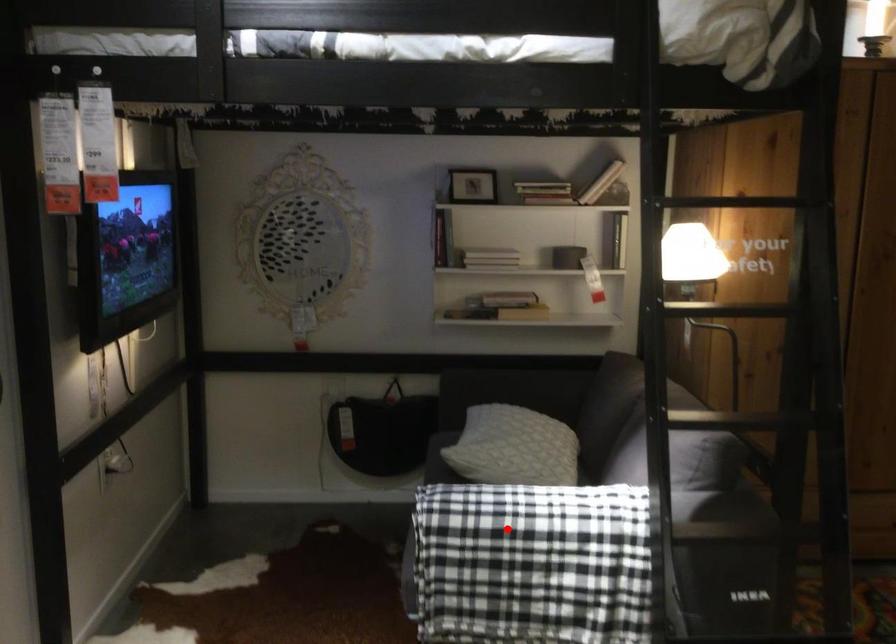
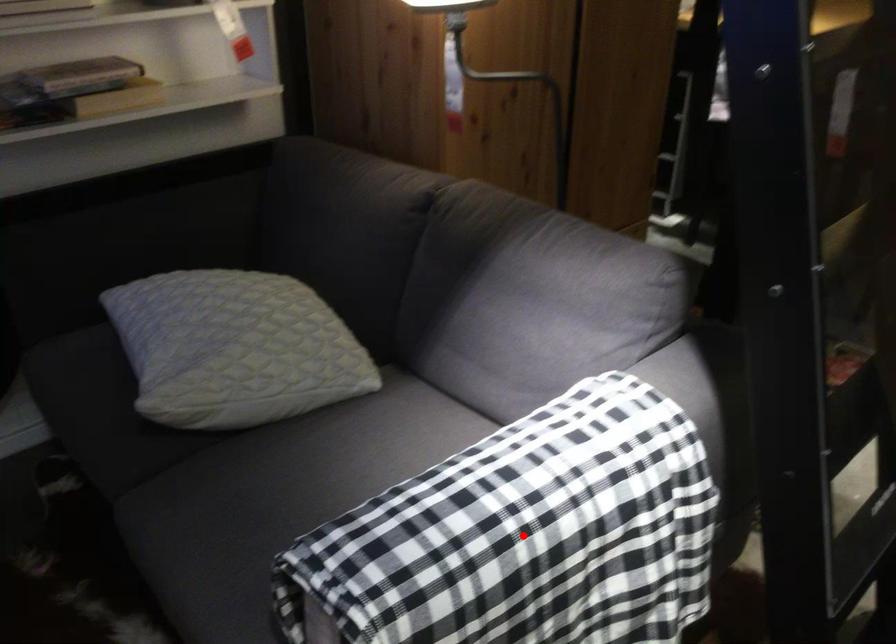
I am providing you with two images of the same scene from different viewpoints. A red point is marked on the first image and another point is marked on the second image. Are the points marked in image1 and image2 representing the same 3D position?

Yes